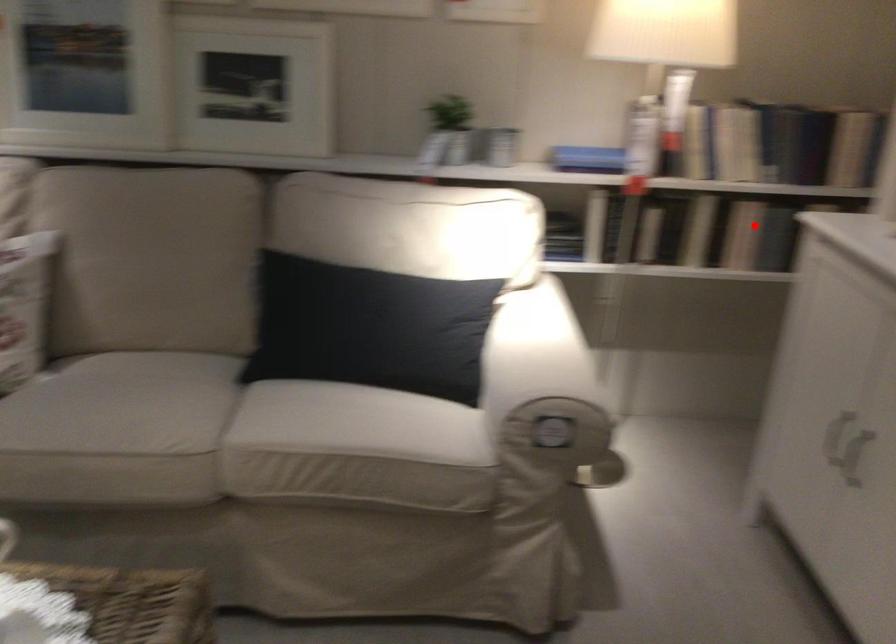
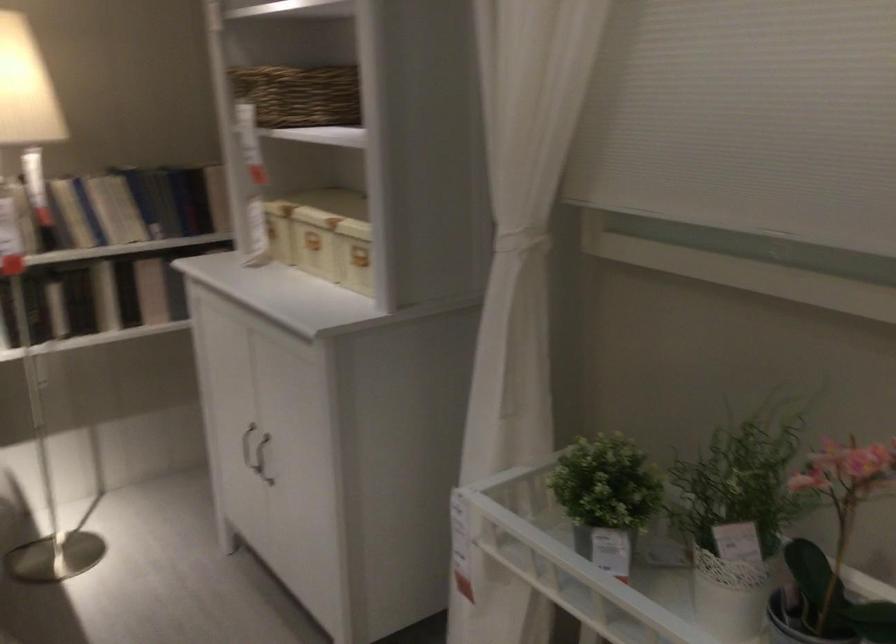
Locate, in the second image, the point that corresponds to the highlighted location in the first image.

(151, 290)